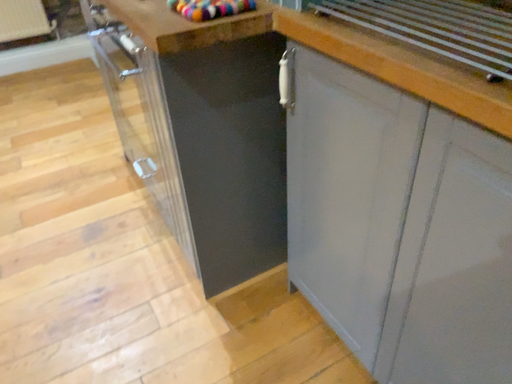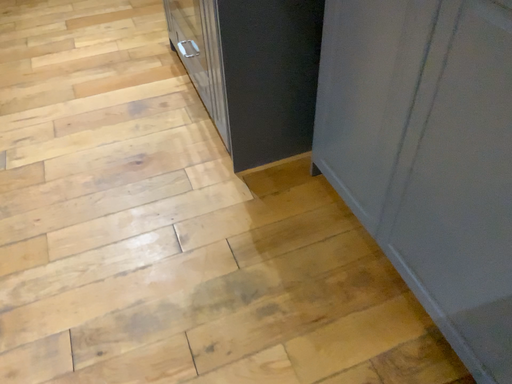
Question: Which way did the camera rotate in the video?

Choices:
 (A) rotated downward
 (B) rotated upward

Answer: (A)